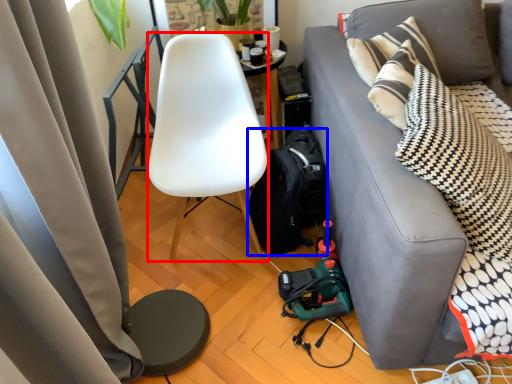
Question: Which object appears closest to the camera in this image, chair (highlighted by a red box) or backpack (highlighted by a blue box)?

Choices:
 (A) chair
 (B) backpack

Answer: (A)